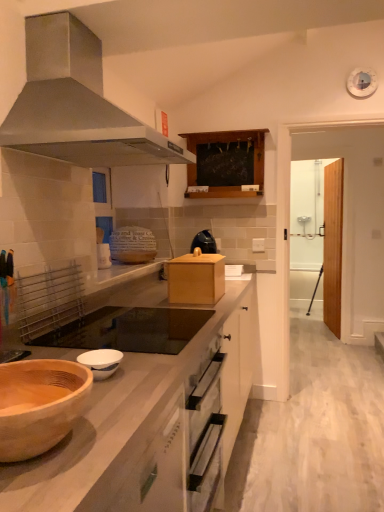
Question: Is the position of transparent glass door at right, which appears as the first glass door when viewed from the right, more distant than that of transparent glass door at right, the first glass door viewed from the left?

Choices:
 (A) yes
 (B) no

Answer: (A)

Question: Can we say transparent glass door at right, the 2th glass door positioned from the left, lies outside transparent glass door at right, the first glass door viewed from the left?

Choices:
 (A) yes
 (B) no

Answer: (A)

Question: Considering the relative sizes of transparent glass door at right, the 2th glass door positioned from the left, and transparent glass door at right, the first glass door viewed from the left, in the image provided, is transparent glass door at right, the 2th glass door positioned from the left, thinner than transparent glass door at right, the first glass door viewed from the left,?

Choices:
 (A) no
 (B) yes

Answer: (A)

Question: Is transparent glass door at right, the 2th glass door positioned from the left, at the left side of transparent glass door at right, the first glass door viewed from the left?

Choices:
 (A) yes
 (B) no

Answer: (B)

Question: Does transparent glass door at right, the 2th glass door positioned from the left, come in front of transparent glass door at right, the 2th glass door viewed from the right?

Choices:
 (A) no
 (B) yes

Answer: (A)

Question: Is transparent glass door at right, the 2th glass door positioned from the left, smaller than transparent glass door at right, the 2th glass door viewed from the right?

Choices:
 (A) no
 (B) yes

Answer: (A)

Question: From a real-world perspective, is black glass gas stove at center under transparent glass door at right, the 2th glass door positioned from the left?

Choices:
 (A) yes
 (B) no

Answer: (A)

Question: Is black glass gas stove at center to the left of transparent glass door at right, which appears as the first glass door when viewed from the right, from the viewer's perspective?

Choices:
 (A) no
 (B) yes

Answer: (B)

Question: Considering the relative sizes of black glass gas stove at center and transparent glass door at right, which appears as the first glass door when viewed from the right, in the image provided, is black glass gas stove at center wider than transparent glass door at right, which appears as the first glass door when viewed from the right,?

Choices:
 (A) yes
 (B) no

Answer: (A)

Question: Is black glass gas stove at center looking in the opposite direction of transparent glass door at right, the 2th glass door positioned from the left?

Choices:
 (A) yes
 (B) no

Answer: (B)

Question: Does black glass gas stove at center appear on the right side of transparent glass door at right, which appears as the first glass door when viewed from the right?

Choices:
 (A) no
 (B) yes

Answer: (A)

Question: Is black glass gas stove at center smaller than transparent glass door at right, the 2th glass door positioned from the left?

Choices:
 (A) yes
 (B) no

Answer: (A)

Question: From a real-world perspective, is wooden at left positioned over black glass gas stove at center based on gravity?

Choices:
 (A) yes
 (B) no

Answer: (B)